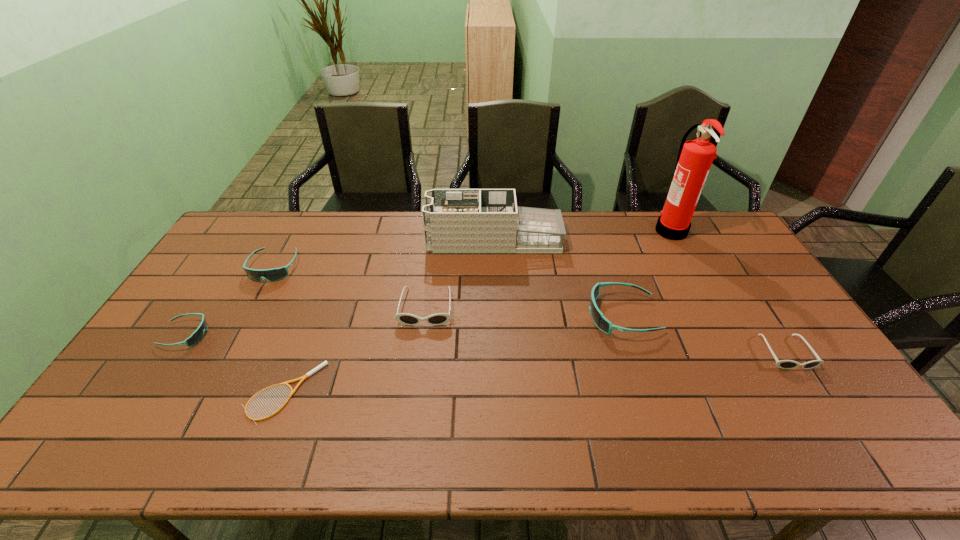
The width and height of the screenshot is (960, 540). Find the location of `the second object from right to left`. the second object from right to left is located at coordinates (695, 157).

Locate an element on the screen. This screenshot has height=540, width=960. the tallest object is located at coordinates (695, 157).

Where is `the second tallest object`? The image size is (960, 540). the second tallest object is located at coordinates (455, 220).

At what (x,y) coordinates should I click in order to perform the action: click on the third tallest object. Please return your answer as a coordinate pair (x, y). The width and height of the screenshot is (960, 540). Looking at the image, I should click on (600, 321).

Find the location of a particular element. Image resolution: width=960 pixels, height=540 pixels. the biggest cyan sunglasses is located at coordinates (600, 321).

Where is `the second cyan sunglasses from left to right`? Image resolution: width=960 pixels, height=540 pixels. the second cyan sunglasses from left to right is located at coordinates (274, 274).

You are a GUI agent. You are given a task and a screenshot of the screen. Output one action in this format:
    pyautogui.click(x=<x>, y=<y>)
    Task: Click on the second sunglasses from left to right
    This screenshot has width=960, height=540.
    Given the screenshot: What is the action you would take?
    pyautogui.click(x=274, y=274)

Find the location of a particular element. This screenshot has width=960, height=540. the bigger black sunglasses is located at coordinates click(436, 319).

Identify the location of the third sunglasses from left to right. This screenshot has width=960, height=540. point(436,319).

You are a GUI agent. You are given a task and a screenshot of the screen. Output one action in this format:
    pyautogui.click(x=<x>, y=<y>)
    Task: Click on the smallest cyan sunglasses
    This screenshot has width=960, height=540.
    Given the screenshot: What is the action you would take?
    tap(197, 336)